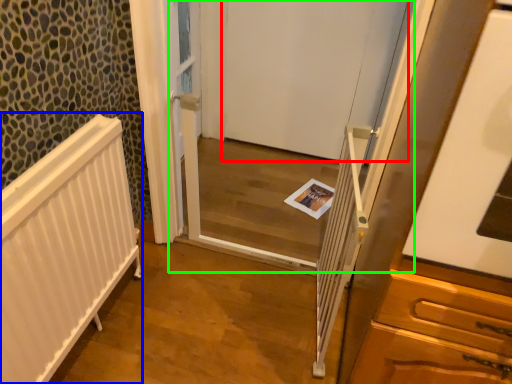
Question: Which object is the farthest from door (highlighted by a red box)? Choose among these: radiator (highlighted by a blue box) or screen door (highlighted by a green box).

Choices:
 (A) radiator
 (B) screen door

Answer: (A)